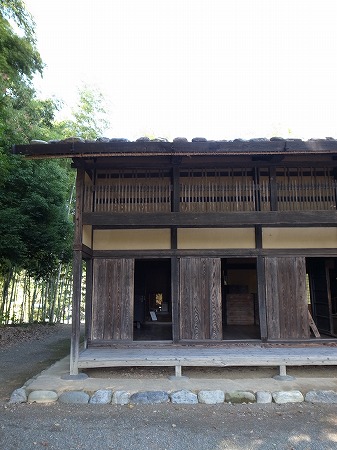
Locate an element on the screen. door is located at coordinates (156, 303), (243, 299), (313, 295).